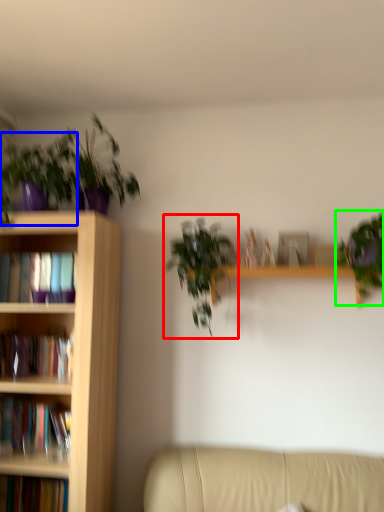
Question: Considering the real-world distances, which object is farthest from houseplant (highlighted by a red box)? houseplant (highlighted by a blue box) or houseplant (highlighted by a green box)?

Choices:
 (A) houseplant
 (B) houseplant

Answer: (A)